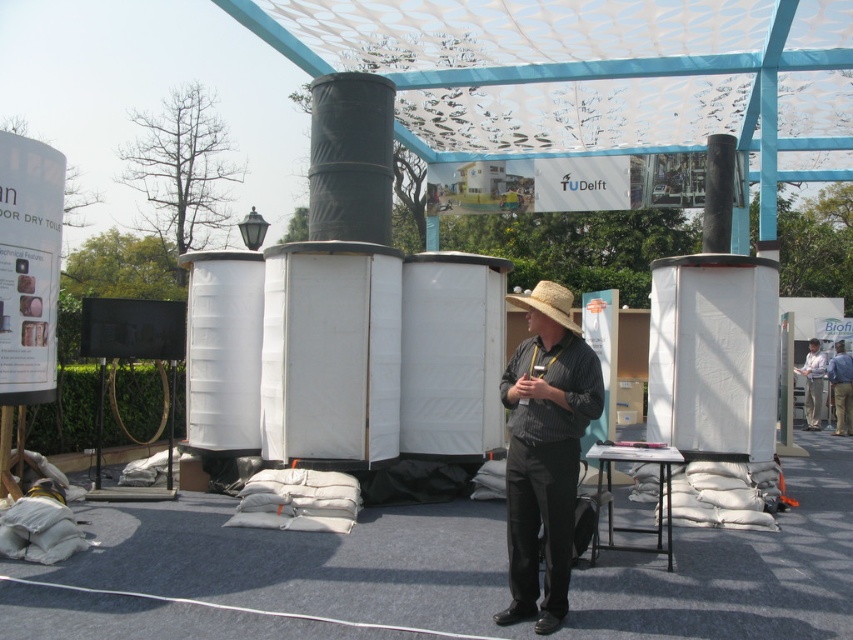
Question: Which object appears farthest from the camera in this image?

Choices:
 (A) white fabric hat at center
 (B) strawhat at center
 (C) matte straw hat at center
 (D) light brown straw hat at center

Answer: (A)

Question: Which point is closer to the camera taking this photo?

Choices:
 (A) (828, 360)
 (B) (804, 365)
 (C) (561, 289)

Answer: (C)

Question: Can you confirm if matte straw hat at center is thinner than strawhat at center?

Choices:
 (A) yes
 (B) no

Answer: (A)

Question: Which of the following is the farthest from the observer?

Choices:
 (A) (808, 369)
 (B) (837, 420)

Answer: (A)

Question: Is matte straw hat at center above white fabric hat at center?

Choices:
 (A) yes
 (B) no

Answer: (A)

Question: From the image, what is the correct spatial relationship of matte straw hat at center in relation to white fabric hat at center?

Choices:
 (A) left
 (B) right

Answer: (A)